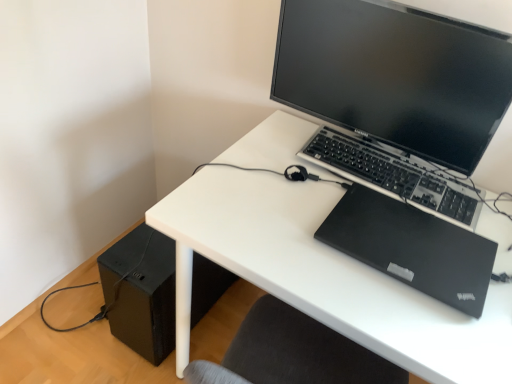
You are a GUI agent. You are given a task and a screenshot of the screen. Output one action in this format:
    pyautogui.click(x=<x>, y=<y>)
    Task: Click on the free area in between matte black monitor at upper center and black matte laptop at upper right
    
    Given the screenshot: What is the action you would take?
    pyautogui.click(x=304, y=178)